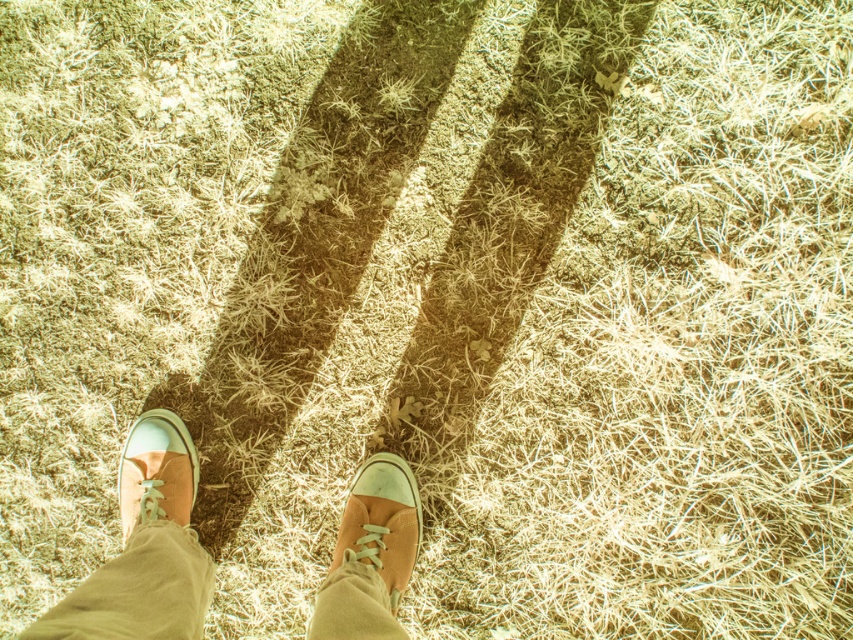
You are a photographer trying to capture the shadow of the khaki pants at lower left and the matte canvas shoe at center. Since the sun is low, which object will cast a longer shadow?

The khaki pants at lower left is positioned on the left side of matte canvas shoe at center. Since the sun is low, the object on the left will cast a longer shadow, so the khaki pants at lower left will have a longer shadow.

You are standing at the origin point of a coordinate system placed over the image. The tan canvas shoes at center are located at a specific coordinate. Can you tell me what their coordinates are?

The tan canvas shoes at center are located at coordinates point (144, 547).

In the scene shown: You are standing on a grassy area and notice a specific point marked at coordinates point (144, 547). Based on the scene, where is this point located?

The point (144, 547) is located on the tan canvas shoes at center.